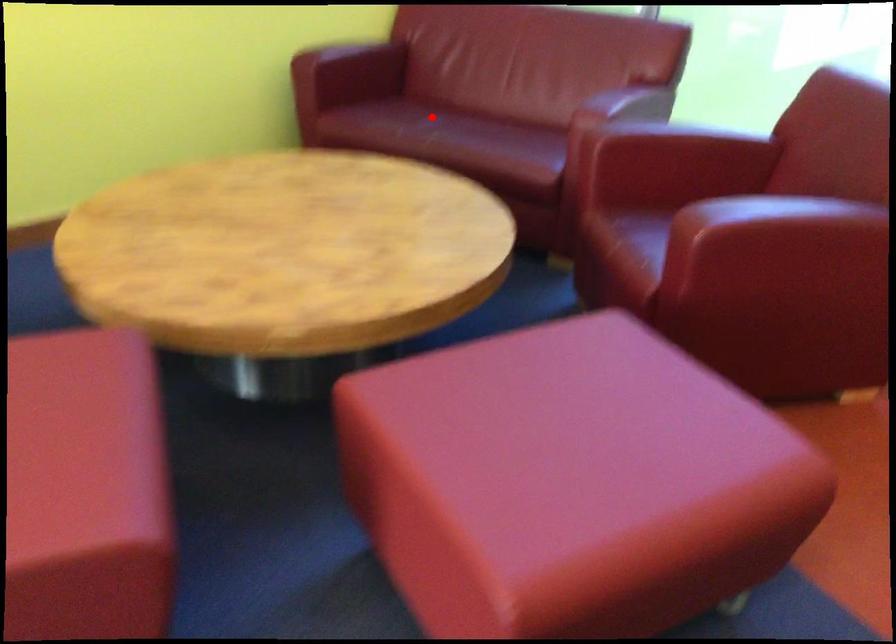
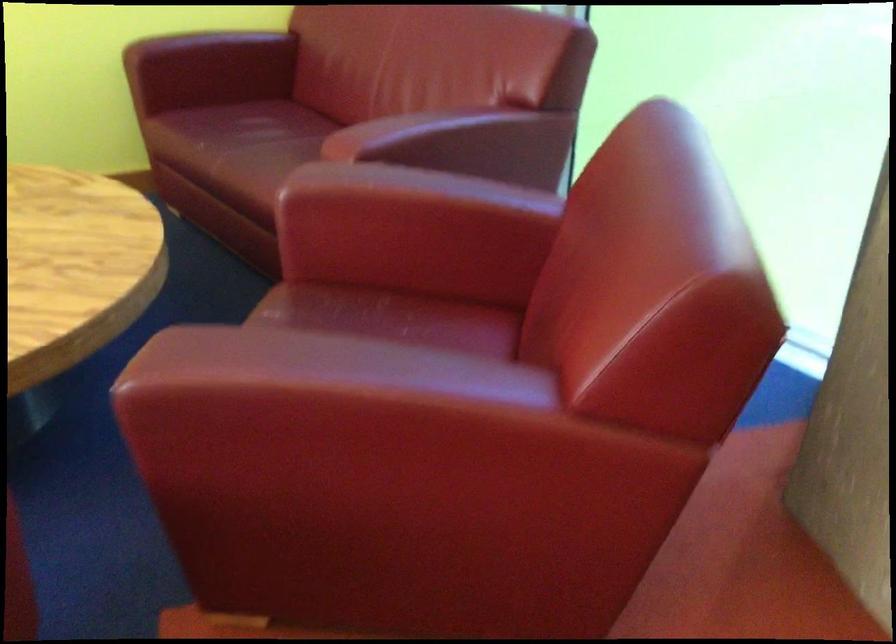
Where in the second image is the point corresponding to the highlighted location from the first image?

(263, 131)